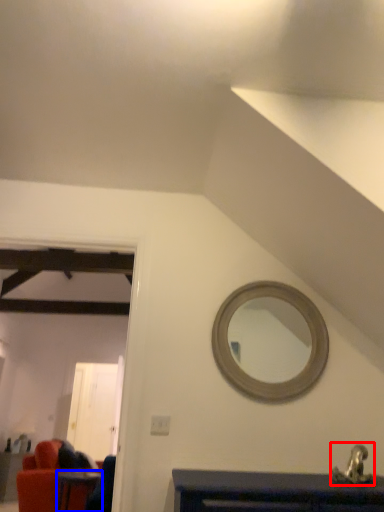
Question: Which of the following is the farthest to the observer, sink (highlighted by a red box) or table (highlighted by a blue box)?

Choices:
 (A) sink
 (B) table

Answer: (B)